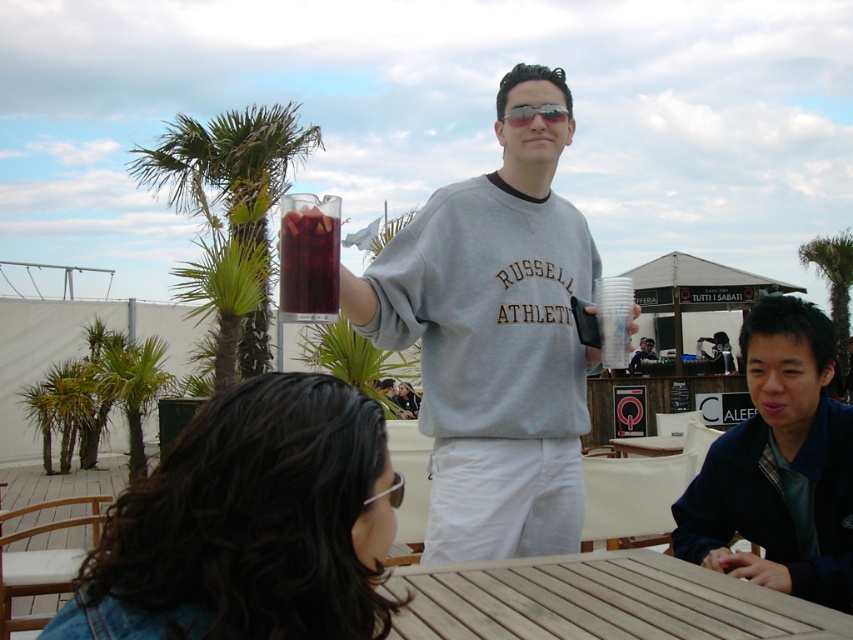
You are at a rooftop party and need to hand out the clear plastic goggles at upper center to a guest. The dark blue jacket at lower right is blocking your path. Can you reach the goggles without moving the jacket?

The clear plastic goggles at upper center is behind the dark blue jacket at lower right, so you cannot reach the goggles without moving the jacket.

You are standing at the point labeled point [520,106] in the image. If you want to take a photo of the entire scene from your current position, will the camera be able to capture everything in the frame without moving?

The distance between point [520,106] and the camera is 2.50 meters. Since the camera is positioned at this point, it can capture the entire scene as long as the field of view accommodates the area within that distance. However, without knowing the camera specifications, it is impossible to definitively confirm if the entire scene will fit in the frame.